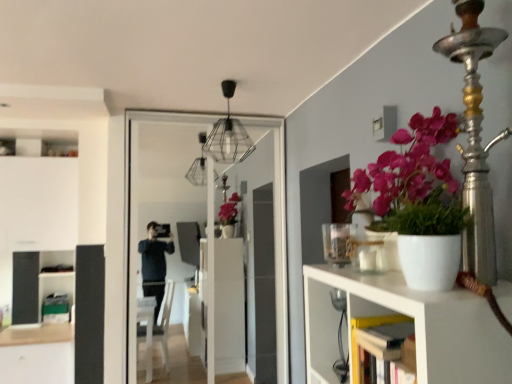
Question: From the image's perspective, is white matte shelf at right above or below clear glass screen door at center?

Choices:
 (A) above
 (B) below

Answer: (B)

Question: Is point (373, 306) closer or farther from the camera than point (271, 258)?

Choices:
 (A) farther
 (B) closer

Answer: (B)

Question: From a real-world perspective, is white matte shelf at right physically located above or below clear glass screen door at center?

Choices:
 (A) below
 (B) above

Answer: (A)

Question: From their relative heights in the image, would you say clear glass screen door at center is taller or shorter than white matte shelf at right?

Choices:
 (A) tall
 (B) short

Answer: (A)

Question: In the image, is clear glass screen door at center on the left side or the right side of white matte shelf at right?

Choices:
 (A) right
 (B) left

Answer: (B)

Question: Looking at the image, does clear glass screen door at center seem bigger or smaller compared to white matte shelf at right?

Choices:
 (A) small
 (B) big

Answer: (B)

Question: Is clear glass screen door at center in front of or behind white matte shelf at right in the image?

Choices:
 (A) front
 (B) behind

Answer: (B)